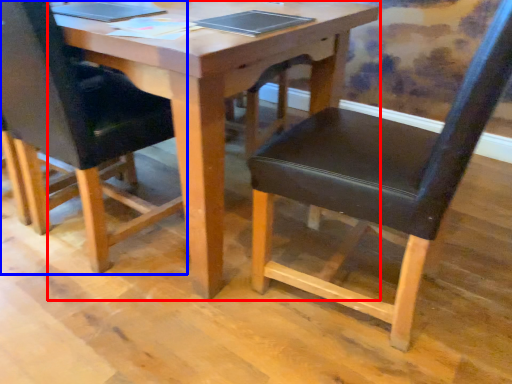
Question: Which object is closer to the camera taking this photo, table (highlighted by a red box) or chair (highlighted by a blue box)?

Choices:
 (A) table
 (B) chair

Answer: (A)